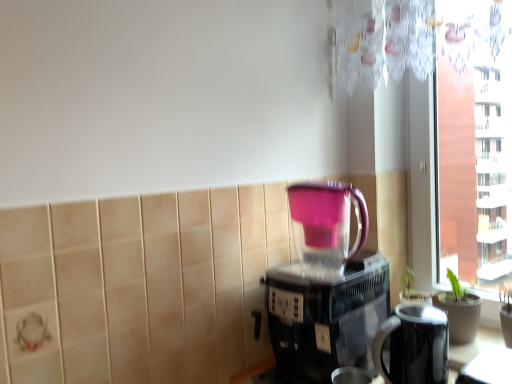
Question: From the image's perspective, is black glossy electric kettle at lower right located above black plastic coffee maker at center?

Choices:
 (A) yes
 (B) no

Answer: (B)

Question: From the image's perspective, is black glossy electric kettle at lower right located beneath black plastic coffee maker at center?

Choices:
 (A) no
 (B) yes

Answer: (B)

Question: From a real-world perspective, is black glossy electric kettle at lower right positioned under black plastic coffee maker at center based on gravity?

Choices:
 (A) yes
 (B) no

Answer: (A)

Question: Is black glossy electric kettle at lower right shorter than black plastic coffee maker at center?

Choices:
 (A) no
 (B) yes

Answer: (B)

Question: Considering the relative sizes of black glossy electric kettle at lower right and black plastic coffee maker at center in the image provided, is black glossy electric kettle at lower right taller than black plastic coffee maker at center?

Choices:
 (A) yes
 (B) no

Answer: (B)

Question: Would you say black plastic coffee maker at center is inside or outside transparent glass window at right?

Choices:
 (A) outside
 (B) inside

Answer: (A)

Question: From a real-world perspective, is black plastic coffee maker at center physically located above or below transparent glass window at right?

Choices:
 (A) above
 (B) below

Answer: (B)

Question: Is black plastic coffee maker at center in front of or behind transparent glass window at right in the image?

Choices:
 (A) behind
 (B) front

Answer: (B)

Question: From the image's perspective, relative to transparent glass window at right, is black plastic coffee maker at center above or below?

Choices:
 (A) above
 (B) below

Answer: (B)

Question: Looking at their shapes, would you say transparent glass window at right is wider or thinner than black glossy electric kettle at lower right?

Choices:
 (A) thin
 (B) wide

Answer: (A)

Question: Is transparent glass window at right bigger or smaller than black glossy electric kettle at lower right?

Choices:
 (A) small
 (B) big

Answer: (B)

Question: From the image's perspective, is transparent glass window at right above or below black glossy electric kettle at lower right?

Choices:
 (A) above
 (B) below

Answer: (A)

Question: From a real-world perspective, is transparent glass window at right above or below black glossy electric kettle at lower right?

Choices:
 (A) above
 (B) below

Answer: (A)

Question: In the image, is transparent glass window at right on the left side or the right side of black plastic coffee maker at center?

Choices:
 (A) left
 (B) right

Answer: (B)

Question: From a real-world perspective, relative to black plastic coffee maker at center, is transparent glass window at right vertically above or below?

Choices:
 (A) above
 (B) below

Answer: (A)